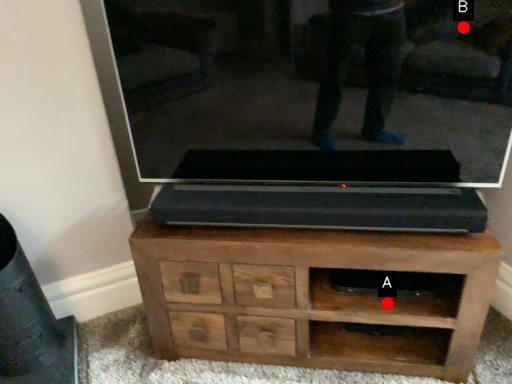
Question: Two points are circled on the image, labeled by A and B beside each circle. Among these points, which one is farthest from the camera?

Choices:
 (A) A is further
 (B) B is further

Answer: (A)